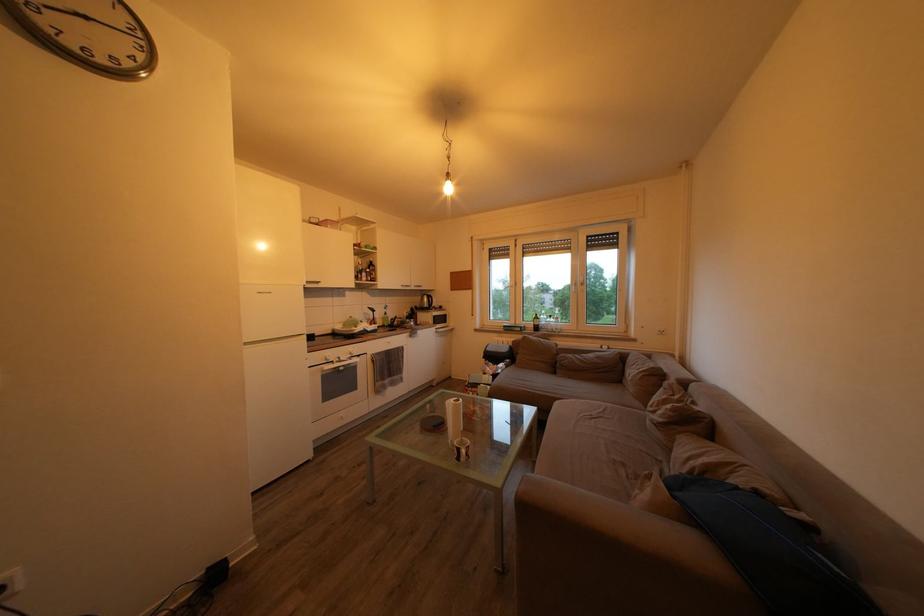
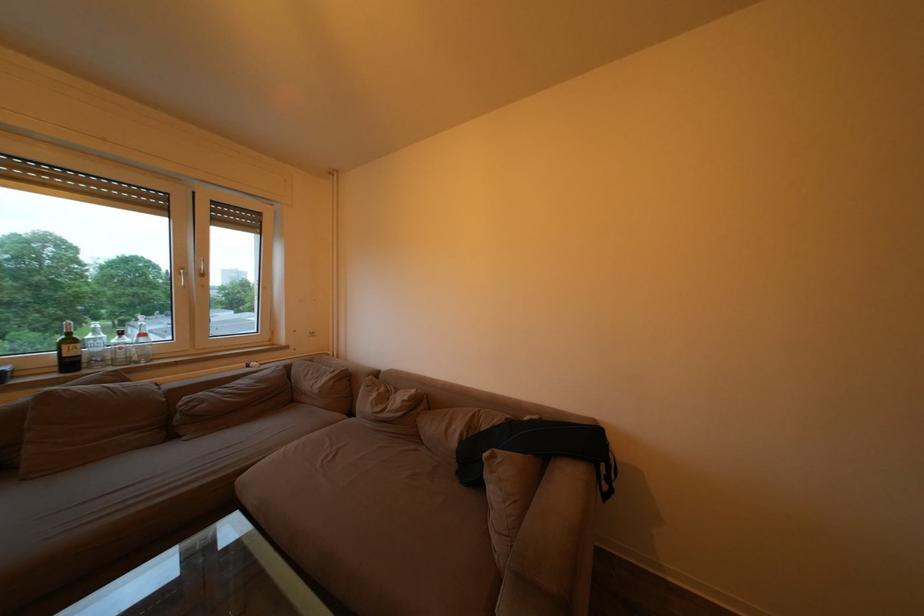
In the second image, find the point that corresponds to the point at 544,323 in the first image.

(79, 347)